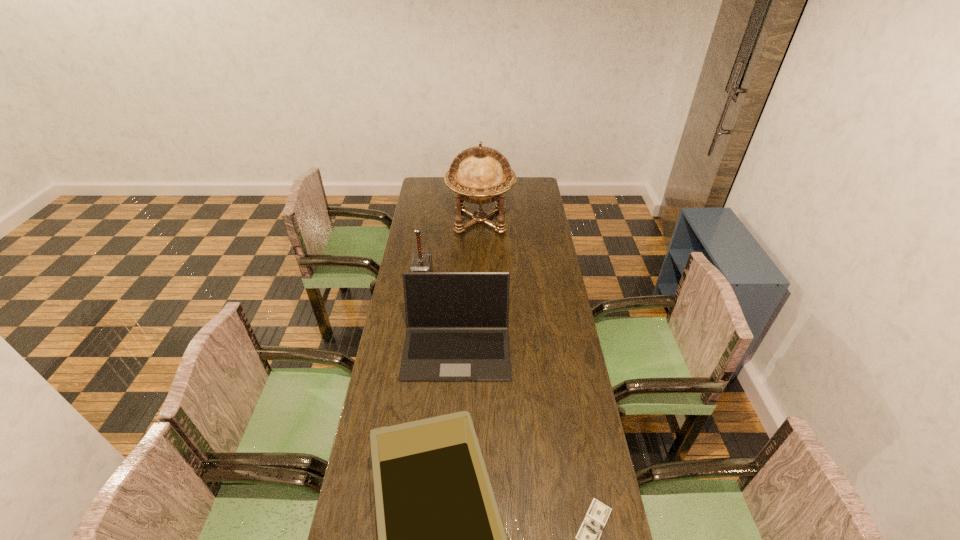
Locate an element on the screen. the tallest object is located at coordinates (480, 175).

Locate an element on the screen. The width and height of the screenshot is (960, 540). the farthest object is located at coordinates (480, 175).

Where is `hammer`? The image size is (960, 540). hammer is located at coordinates (421, 261).

The height and width of the screenshot is (540, 960). In order to click on laptop in this screenshot , I will do `click(457, 322)`.

Image resolution: width=960 pixels, height=540 pixels. Identify the location of vacant region located 0.220m on the front-facing side of the globe. (480, 269).

Where is `free space located 0.390m on the back of the hammer`? The image size is (960, 540). free space located 0.390m on the back of the hammer is located at coordinates (431, 219).

I want to click on vacant space positioned on the screen of the laptop, so click(452, 430).

I want to click on hammer located in the left edge section of the desktop, so click(x=421, y=261).

Find the location of a particular element. The image size is (960, 540). laptop at the left edge is located at coordinates (457, 322).

Locate an element on the screen. This screenshot has width=960, height=540. free region at the far edge of the desktop is located at coordinates (446, 188).